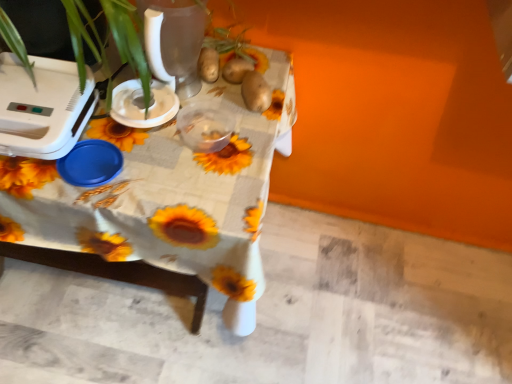
Image resolution: width=512 pixels, height=384 pixels. Find the location of `spots to the right of white plastic blender at upper left, which appears as the first appliance when viewed from the right`. spots to the right of white plastic blender at upper left, which appears as the first appliance when viewed from the right is located at coordinates (227, 130).